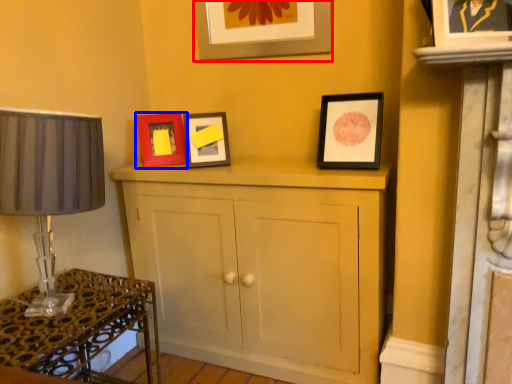
Question: Which object is further to the camera taking this photo, picture frame (highlighted by a red box) or picture frame (highlighted by a blue box)?

Choices:
 (A) picture frame
 (B) picture frame

Answer: (B)